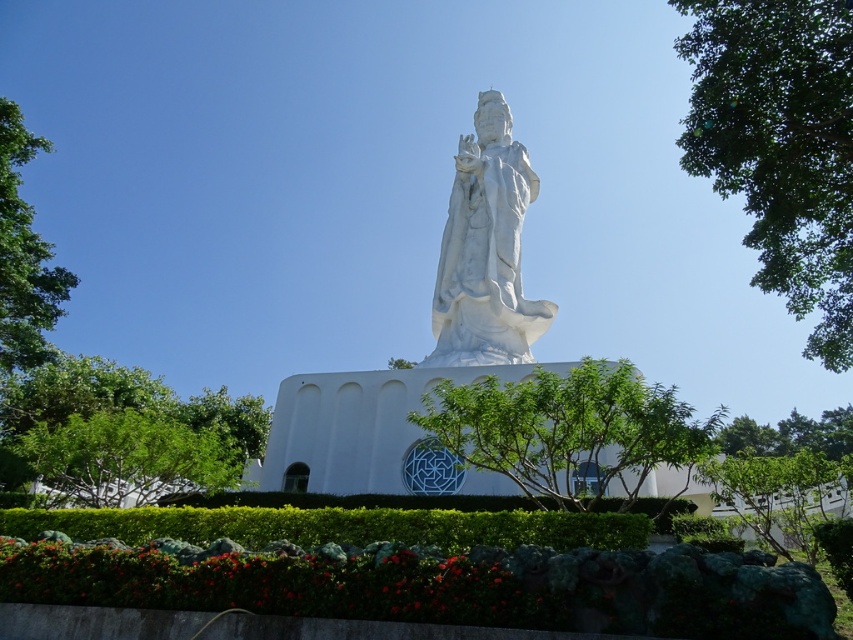
Is the position of green leafy tree at center more distant than that of white marble statue at center?

No, it is in front of white marble statue at center.

Is green leafy tree at center closer to the viewer compared to white marble statue at center?

That is True.

Between point (474, 420) and point (497, 93), which one is positioned behind?

The point (497, 93) is behind.

Locate an element on the screen. The height and width of the screenshot is (640, 853). green leafy tree at center is located at coordinates (567, 429).

Between green leafy tree at lower left and green leafy tree at left, which one is positioned higher?

green leafy tree at left

Does green leafy tree at lower left appear under green leafy tree at left?

Yes, green leafy tree at lower left is below green leafy tree at left.

Is point (51, 378) positioned before point (4, 296)?

No.

You are a GUI agent. You are given a task and a screenshot of the screen. Output one action in this format:
    pyautogui.click(x=<x>, y=<y>)
    Task: Click on the green leafy tree at lower left
    The image size is (853, 640).
    Given the screenshot: What is the action you would take?
    pyautogui.click(x=125, y=432)

Which is more to the left, green leafy tree at upper right or green leafy tree at lower left?

From the viewer's perspective, green leafy tree at lower left appears more on the left side.

Does green leafy tree at upper right appear on the right side of green leafy tree at lower left?

Indeed, green leafy tree at upper right is positioned on the right side of green leafy tree at lower left.

Is point (846, 16) behind point (7, 417)?

That is False.

Identify the location of green leafy tree at upper right. (780, 145).